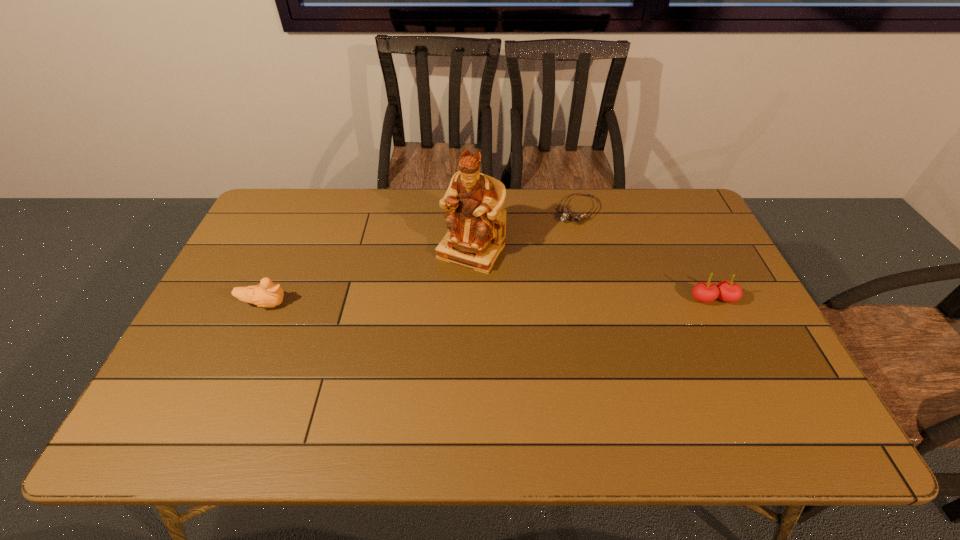
You are a GUI agent. You are given a task and a screenshot of the screen. Output one action in this format:
    pyautogui.click(x=<x>, y=<y>)
    Task: Click on the vacant point located between the duckling and the third object from left to right
    This screenshot has width=960, height=540.
    Given the screenshot: What is the action you would take?
    pyautogui.click(x=421, y=258)

This screenshot has height=540, width=960. I want to click on vacant area that lies between the duckling and the goggles, so click(x=421, y=258).

Find the location of a particular element. Image resolution: width=960 pixels, height=540 pixels. vacant space that is in between the leftmost object and the rightmost object is located at coordinates coord(489,302).

You are a GUI agent. You are given a task and a screenshot of the screen. Output one action in this format:
    pyautogui.click(x=<x>, y=<y>)
    Task: Click on the closest object to the second object from left to right
    The height and width of the screenshot is (540, 960).
    Given the screenshot: What is the action you would take?
    pyautogui.click(x=577, y=217)

I want to click on the second closest object to the tallest object, so click(x=267, y=294).